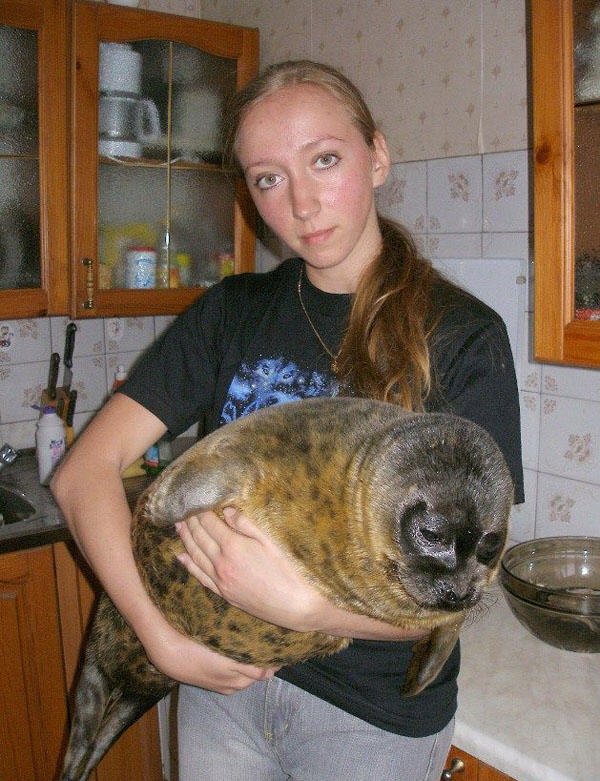
Find the location of `coffeemaker`. coffeemaker is located at coordinates (119, 112).